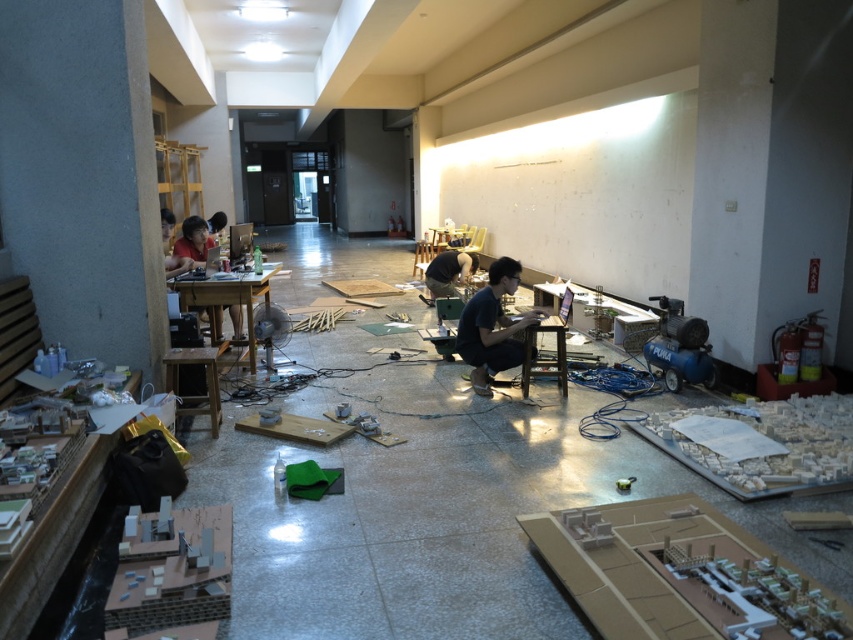
You are an intern in the design studio and need to find the dark blue shirt at center and the matte black shirt at left. Which shirt is closer to the entrance of the room?

The matte black shirt at left is closer to the entrance because it is on the left side of the dark blue shirt at center, which is positioned further to the right.

You are an intern at the architectural firm and need to choose a shirt to wear for a presentation. You have two options in the room, the dark blue shirt at center and the matte black shirt at left. Which shirt has a larger width?

The dark blue shirt at center has a larger width than the matte black shirt at left according to the description.

You are an architect working in this space and need to locate two specific items. There is a matte black shirt at center and a matte black shirt at upper left. Which one is positioned more to the right side of the room?

The matte black shirt at center is positioned more to the right side of the room compared to the matte black shirt at upper left.